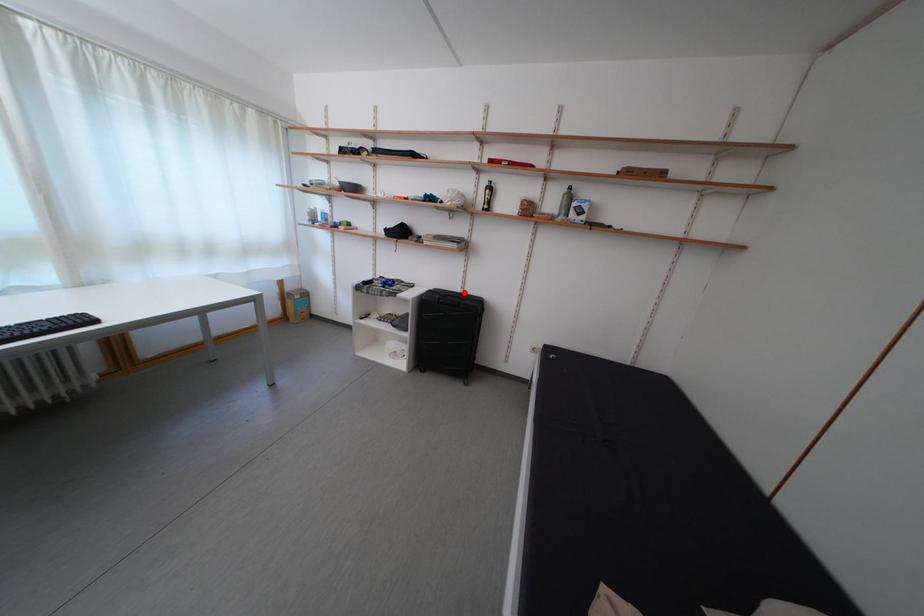
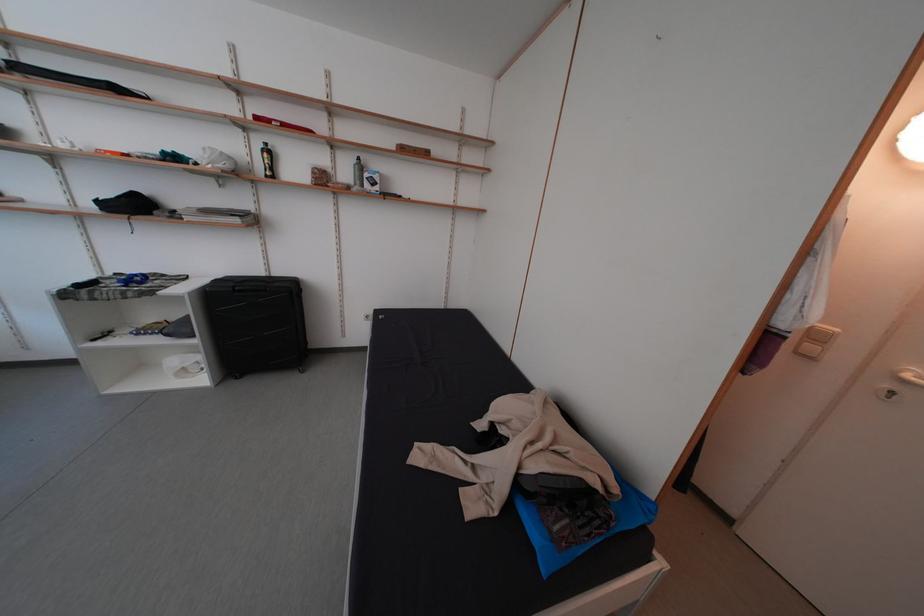
Where in the second image is the point corresponding to the highlighted location from the first image?

(265, 276)